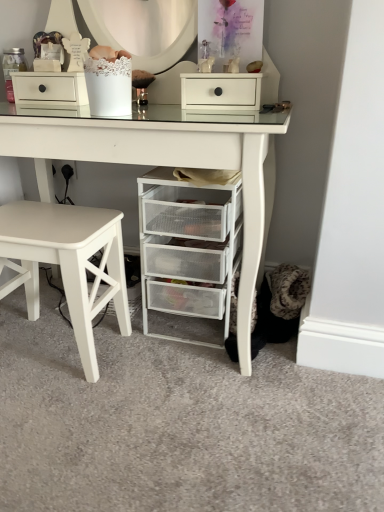
What do you see at coordinates (220, 91) in the screenshot?
I see `white matte drawer at upper center` at bounding box center [220, 91].

What do you see at coordinates (160, 161) in the screenshot? I see `white mesh drawer unit at lower center` at bounding box center [160, 161].

This screenshot has height=512, width=384. Identify the location of white mesh drawer unit at lower right. (188, 248).

Is white matte stool at lower left far from white mesh drawer unit at lower center?

No.

Where is `stool that is on the left side of white mesh drawer unit at lower center`? Image resolution: width=384 pixels, height=512 pixels. stool that is on the left side of white mesh drawer unit at lower center is located at coordinates (67, 263).

From a real-world perspective, is white matte stool at lower left on top of white mesh drawer unit at lower center?

No.

Consider the image. Is white matte stool at lower left positioned with its back to white mesh drawer unit at lower center?

Yes, white matte stool at lower left is positioned with its back facing white mesh drawer unit at lower center.

Is white matte stool at lower left situated inside white matte drawer at upper center or outside?

white matte stool at lower left lies outside white matte drawer at upper center.

From the image's perspective, would you say white matte stool at lower left is shown under white matte drawer at upper center?

Yes, from the image's perspective, white matte stool at lower left is beneath white matte drawer at upper center.

Considering the relative positions of white matte stool at lower left and white matte drawer at upper center in the image provided, is white matte stool at lower left to the left or to the right of white matte drawer at upper center?

white matte stool at lower left is positioned on white matte drawer at upper center's left side.

From the image's perspective, which object appears higher, white mesh drawer unit at lower right or white matte drawer at upper center?

white matte drawer at upper center, from the image's perspective.

Who is smaller, white mesh drawer unit at lower right or white matte drawer at upper center?

Smaller between the two is white matte drawer at upper center.

Is there a large distance between white mesh drawer unit at lower right and white matte drawer at upper center?

white mesh drawer unit at lower right is actually quite close to white matte drawer at upper center.

Consider the image. Can white mesh drawer unit at lower right be found inside white mesh drawer unit at lower center?

Yes, white mesh drawer unit at lower right is a part of white mesh drawer unit at lower center.

Can you tell me how much white mesh drawer unit at lower center and white mesh drawer unit at lower right differ in facing direction?

white mesh drawer unit at lower center and white mesh drawer unit at lower right are facing 2 degrees away from each other.

Is the position of white mesh drawer unit at lower center less distant than that of white mesh drawer unit at lower right?

Yes, it is.

Image resolution: width=384 pixels, height=512 pixels. In order to click on the chest of drawers located underneath the white mesh drawer unit at lower center (from a real-world perspective) in this screenshot , I will do `click(188, 248)`.

Considering the sizes of objects white mesh drawer unit at lower center and white matte drawer at upper center in the image provided, who is taller, white mesh drawer unit at lower center or white matte drawer at upper center?

With more height is white mesh drawer unit at lower center.

Which object is wider, white mesh drawer unit at lower center or white matte drawer at upper center?

white mesh drawer unit at lower center is wider.

Which is more to the right, white mesh drawer unit at lower center or white matte drawer at upper center?

Positioned to the right is white matte drawer at upper center.

Is white mesh drawer unit at lower center in front of white matte drawer at upper center?

That is True.

From the image's perspective, relative to white matte stool at lower left, is white mesh drawer unit at lower center above or below?

white mesh drawer unit at lower center is above white matte stool at lower left.

Is white mesh drawer unit at lower center positioned far away from white matte stool at lower left?

white mesh drawer unit at lower center is actually quite close to white matte stool at lower left.

Is point (259, 228) farther from camera compared to point (12, 223)?

No, it is not.

Could you tell me if white mesh drawer unit at lower center is turned towards white matte stool at lower left?

Yes, white mesh drawer unit at lower center is turned towards white matte stool at lower left.

Can you confirm if white matte drawer at upper center is taller than white matte stool at lower left?

Incorrect, the height of white matte drawer at upper center is not larger of that of white matte stool at lower left.

From a real-world perspective, which is physically below, white matte drawer at upper center or white matte stool at lower left?

In real-world perspective, white matte stool at lower left is lower.

The image size is (384, 512). What are the coordinates of `table above the white matte stool at lower left (from a real-world perspective)` in the screenshot? It's located at (160, 161).

This screenshot has height=512, width=384. In order to click on drawer that appears on the right of white matte stool at lower left in this screenshot , I will do `click(220, 91)`.

Looking at the image, which one is located closer to white mesh drawer unit at lower center, white matte drawer at upper center or white mesh drawer unit at lower right?

white mesh drawer unit at lower right lies closer to white mesh drawer unit at lower center than the other object.

When comparing their distances from white matte stool at lower left, does white mesh drawer unit at lower right or white matte drawer at upper center seem further?

Among the two, white matte drawer at upper center is located further to white matte stool at lower left.

Which object lies nearer to the anchor point white matte stool at lower left, white mesh drawer unit at lower center or white matte drawer at upper center?

white mesh drawer unit at lower center.

Consider the image. When comparing their distances from white mesh drawer unit at lower right, does white matte stool at lower left or white matte drawer at upper center seem further?

white matte drawer at upper center is positioned further to the anchor white mesh drawer unit at lower right.

Looking at the image, which one is located closer to white mesh drawer unit at lower right, white matte drawer at upper center or white matte stool at lower left?

white matte stool at lower left lies closer to white mesh drawer unit at lower right than the other object.

When comparing their distances from white mesh drawer unit at lower center, does white matte drawer at upper center or white matte stool at lower left seem further?

white matte stool at lower left.

Which object lies further to the anchor point white matte stool at lower left, white matte drawer at upper center or white mesh drawer unit at lower center?

Among the two, white matte drawer at upper center is located further to white matte stool at lower left.

Estimate the real-world distances between objects in this image. Which object is closer to white matte drawer at upper center, white mesh drawer unit at lower right or white mesh drawer unit at lower center?

white mesh drawer unit at lower center lies closer to white matte drawer at upper center than the other object.

Identify the location of table between white matte drawer at upper center and white matte stool at lower left in the up-down direction. The width and height of the screenshot is (384, 512). (160, 161).

Locate an element on the screen. This screenshot has width=384, height=512. table between white matte stool at lower left and white mesh drawer unit at lower right is located at coordinates (160, 161).

Find the location of a particular element. This screenshot has width=384, height=512. table between white matte drawer at upper center and white mesh drawer unit at lower right vertically is located at coordinates (160, 161).

This screenshot has height=512, width=384. I want to click on chest of drawers between white matte drawer at upper center and white matte stool at lower left in the vertical direction, so click(188, 248).